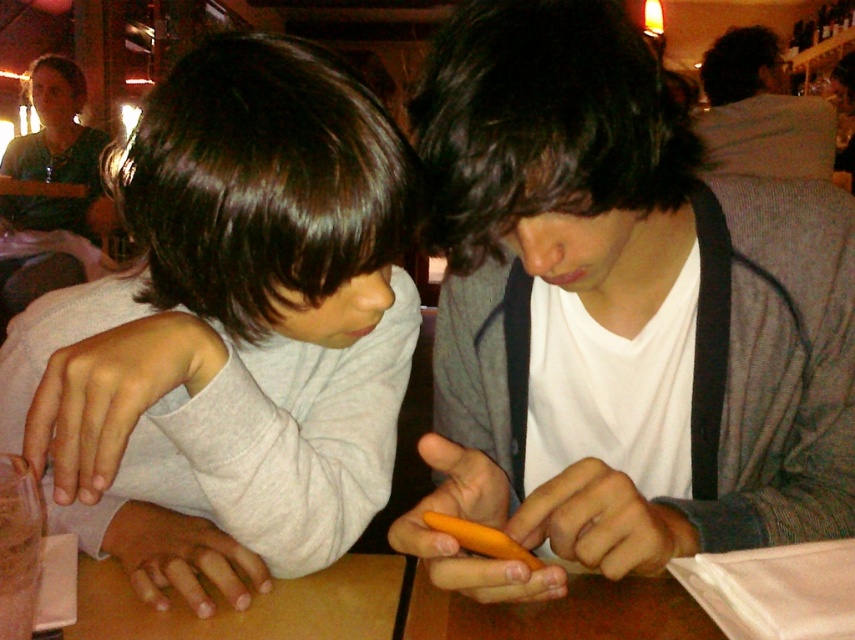
Question: Which point is farther to the camera?

Choices:
 (A) (494, 554)
 (B) (728, 452)
 (C) (771, 65)

Answer: (C)

Question: Does matte gray sweatshirt at left appear over matte green shirt at upper left?

Choices:
 (A) yes
 (B) no

Answer: (B)

Question: Is brown wooden table at lower center wider than gray wool sweater at upper right?

Choices:
 (A) no
 (B) yes

Answer: (A)

Question: Is orange matte phone at center smaller than matte gray sweatshirt at left?

Choices:
 (A) no
 (B) yes

Answer: (A)

Question: Which point is closer to the camera?

Choices:
 (A) (447, 515)
 (B) (446, 45)
 (C) (115, 609)
 (D) (33, 253)

Answer: (A)

Question: Which object is closer to the camera taking this photo?

Choices:
 (A) matte gray sweatshirt at left
 (B) brown wooden table at lower center
 (C) orange matte carrot at center

Answer: (A)